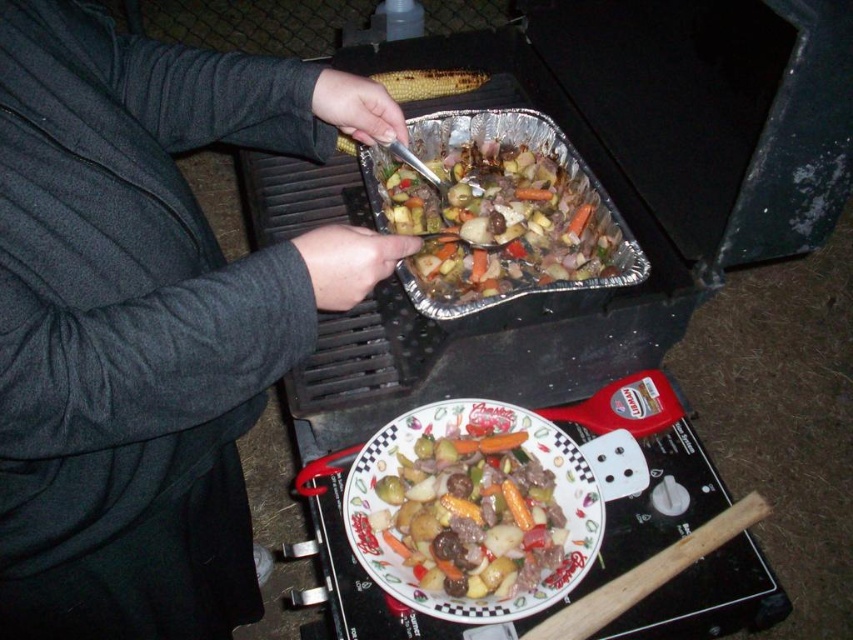
Question: Is decorative ceramic plate at center positioned at the back of grilled yellow corn at upper center?

Choices:
 (A) no
 (B) yes

Answer: (A)

Question: Estimate the real-world distances between objects in this image. Which object is farther from the grilled yellow corn at upper center?

Choices:
 (A) dark gray sweater at upper left
 (B) shiny aluminum foil at center

Answer: (A)

Question: Which point appears closest to the camera in this image?

Choices:
 (A) (415, 93)
 (B) (529, 248)
 (C) (166, 234)
 (D) (399, 436)

Answer: (C)

Question: Can you confirm if shiny aluminum foil at center is wider than decorative ceramic plate at center?

Choices:
 (A) yes
 (B) no

Answer: (A)

Question: Estimate the real-world distances between objects in this image. Which object is closer to the grilled yellow corn at upper center?

Choices:
 (A) dark gray sweater at upper left
 (B) shiny aluminum foil at center

Answer: (B)

Question: Does shiny aluminum foil at center appear on the right side of decorative ceramic plate at center?

Choices:
 (A) no
 (B) yes

Answer: (B)